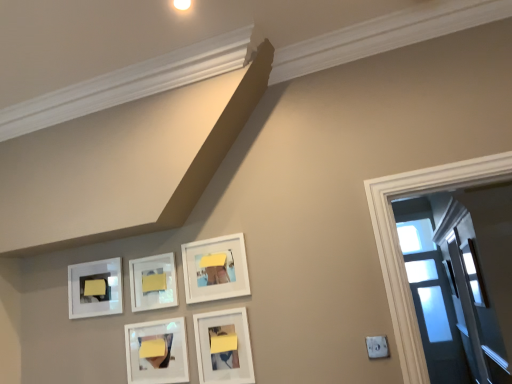
Question: Visually, is white matte picture frame at upper center, the 2th picture frame when ordered from right to left, positioned to the left or to the right of matte yellow paper at upper left, which ranks as the 2th furniture in right-to-left order?

Choices:
 (A) right
 (B) left

Answer: (A)

Question: Is white matte picture frame at upper center, the 2th picture frame when ordered from right to left, situated inside matte yellow paper at upper left, which ranks as the 2th furniture in right-to-left order, or outside?

Choices:
 (A) inside
 (B) outside

Answer: (B)

Question: Which of these objects is positioned closest to the transparent glass door at right?

Choices:
 (A) matte white picture frame at lower center, the fifth picture frame when ordered from left to right
 (B) matte white picture frame at lower center, the 3th picture frame when ordered from left to right
 (C) matte yellow paper at upper left, which is the first furniture from left to right
 (D) white matte picture frame at upper center, the 4th picture frame positioned from the left
 (E) yellow matte paper at center, which is counted as the first furniture, starting from the front

Answer: (D)

Question: Which object is the closest to the clear glass window at right?

Choices:
 (A) matte yellow paper at upper left, positioned as the first furniture in back-to-front order
 (B) white matte picture frame at center, positioned as the 2th picture frame in left-to-right order
 (C) white matte picture frame at upper left, the 5th picture frame when ordered from right to left
 (D) matte white picture frame at lower center, which appears as the 3th picture frame when viewed from the right
 (E) yellow matte paper at center, which is counted as the first furniture, starting from the front

Answer: (D)